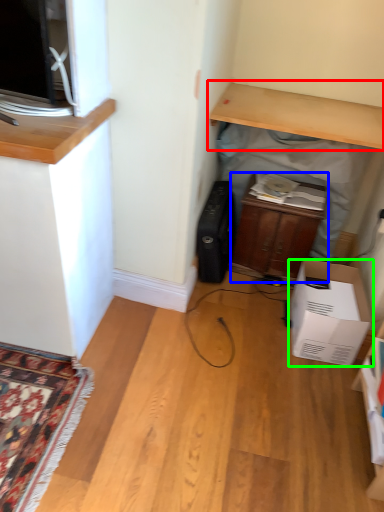
Question: Which object is positioned closest to desk (highlighted by a red box)? Select from cabinetry (highlighted by a blue box) and cardboard box (highlighted by a green box).

Choices:
 (A) cabinetry
 (B) cardboard box

Answer: (A)